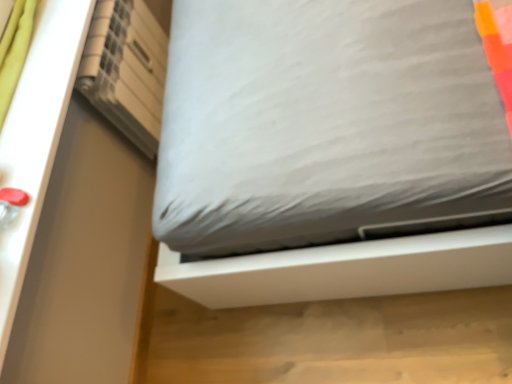
The width and height of the screenshot is (512, 384). Describe the element at coordinates (329, 151) in the screenshot. I see `white fabric bed at center` at that location.

Find the location of `white fabric bed at center`. white fabric bed at center is located at coordinates coord(329,151).

Image resolution: width=512 pixels, height=384 pixels. Describe the element at coordinates (125, 69) in the screenshot. I see `white matte shelf at upper left` at that location.

Find the location of `white matte shelf at upper left`. white matte shelf at upper left is located at coordinates (125, 69).

Identify the location of white fabric bed at center. The width and height of the screenshot is (512, 384). (329, 151).

Visually, is white fabric bed at center positioned to the left or to the right of white matte shelf at upper left?

In the image, white fabric bed at center appears on the right side of white matte shelf at upper left.

Does white fabric bed at center lie behind white matte shelf at upper left?

No.

Between point (238, 201) and point (117, 62), which one is positioned behind?

The point (117, 62) is farther from the camera.

From the image's perspective, is white fabric bed at center positioned above or below white matte shelf at upper left?

From the image's perspective, white fabric bed at center appears below white matte shelf at upper left.

From a real-world perspective, is white fabric bed at center positioned over white matte shelf at upper left based on gravity?

No, from a real-world perspective, white fabric bed at center is not above white matte shelf at upper left.

Considering the sizes of white fabric bed at center and white matte shelf at upper left in the image, is white fabric bed at center wider or thinner than white matte shelf at upper left?

Clearly, white fabric bed at center has more width compared to white matte shelf at upper left.

Can you confirm if white fabric bed at center is shorter than white matte shelf at upper left?

Indeed, white fabric bed at center has a lesser height compared to white matte shelf at upper left.

Which of these two, white fabric bed at center or white matte shelf at upper left, is bigger?

white matte shelf at upper left.

Which is correct: white fabric bed at center is inside white matte shelf at upper left, or outside of it?

white fabric bed at center is spatially situated outside white matte shelf at upper left.

Is white fabric bed at center not close to white matte shelf at upper left?

No, white fabric bed at center is in close proximity to white matte shelf at upper left.

Is white fabric bed at center oriented towards white matte shelf at upper left?

No, white fabric bed at center is not oriented towards white matte shelf at upper left.

In order to click on shelf on the left of the white fabric bed at center in this screenshot , I will do `click(125, 69)`.

Is white matte shelf at upper left to the left of white fabric bed at center from the viewer's perspective?

Correct, you'll find white matte shelf at upper left to the left of white fabric bed at center.

Is white matte shelf at upper left further to camera compared to white fabric bed at center?

Yes, white matte shelf at upper left is further from the camera.

Considering the points (122, 123) and (405, 1), which point is behind, point (122, 123) or point (405, 1)?

The point (122, 123) is farther from the camera.

Looking at this image, from the image's perspective, between white matte shelf at upper left and white fabric bed at center, who is located below?

From the image's view, white fabric bed at center is below.

From a real-world perspective, who is located higher, white matte shelf at upper left or white fabric bed at center?

white matte shelf at upper left.

Can you confirm if white matte shelf at upper left is wider than white fabric bed at center?

In fact, white matte shelf at upper left might be narrower than white fabric bed at center.

In terms of height, does white matte shelf at upper left look taller or shorter compared to white fabric bed at center?

white matte shelf at upper left is taller than white fabric bed at center.

Which of these two, white matte shelf at upper left or white fabric bed at center, is smaller?

white fabric bed at center is smaller.

Is white fabric bed at center located within white matte shelf at upper left?

No, white matte shelf at upper left does not contain white fabric bed at center.

Is white matte shelf at upper left positioned far away from white fabric bed at center?

white matte shelf at upper left is actually quite close to white fabric bed at center.

Could you tell me if white matte shelf at upper left is facing white fabric bed at center?

No, white matte shelf at upper left is not turned towards white fabric bed at center.

What's the angular difference between white matte shelf at upper left and white fabric bed at center's facing directions?

The angle between the facing direction of white matte shelf at upper left and the facing direction of white fabric bed at center is 0.211 degrees.

Identify the location of shelf lying on the left of white fabric bed at center. Image resolution: width=512 pixels, height=384 pixels. (125, 69).

Find the location of a particular element. This screenshot has width=512, height=384. bed below the white matte shelf at upper left (from the image's perspective) is located at coordinates (329, 151).

Where is `shelf above the white fabric bed at center (from a real-world perspective)`? The height and width of the screenshot is (384, 512). shelf above the white fabric bed at center (from a real-world perspective) is located at coordinates click(x=125, y=69).